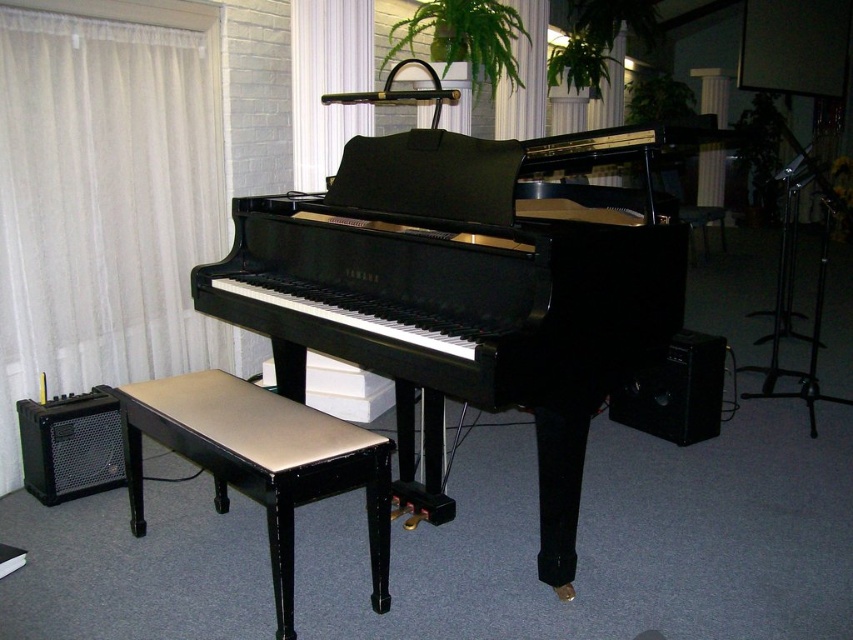
Question: Does black mesh speaker at lower left appear under black matte speaker at lower right?

Choices:
 (A) no
 (B) yes

Answer: (B)

Question: Which object is positioned closest to the white sheer curtain at left?

Choices:
 (A) black polished piano at center
 (B) black mesh speaker at lower left

Answer: (B)

Question: Among these objects, which one is nearest to the camera?

Choices:
 (A) white sheer curtain at upper center
 (B) black matte speaker at lower right
 (C) white sheer curtain at left

Answer: (C)

Question: Is black mesh speaker at lower left wider than white sheer curtain at upper right?

Choices:
 (A) no
 (B) yes

Answer: (A)

Question: Which object appears farthest from the camera in this image?

Choices:
 (A) black polished piano at center
 (B) black mesh speaker at lower left

Answer: (B)

Question: Does black polished piano at center appear on the right side of black matte speaker at lower right?

Choices:
 (A) no
 (B) yes

Answer: (A)